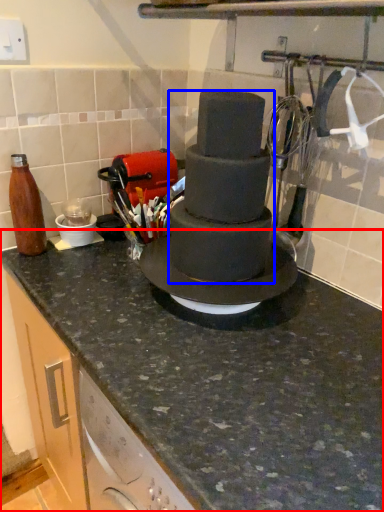
Question: Which point is closer to the camera, countertop (highlighted by a red box) or chocolate cake (highlighted by a blue box)?

Choices:
 (A) countertop
 (B) chocolate cake

Answer: (A)